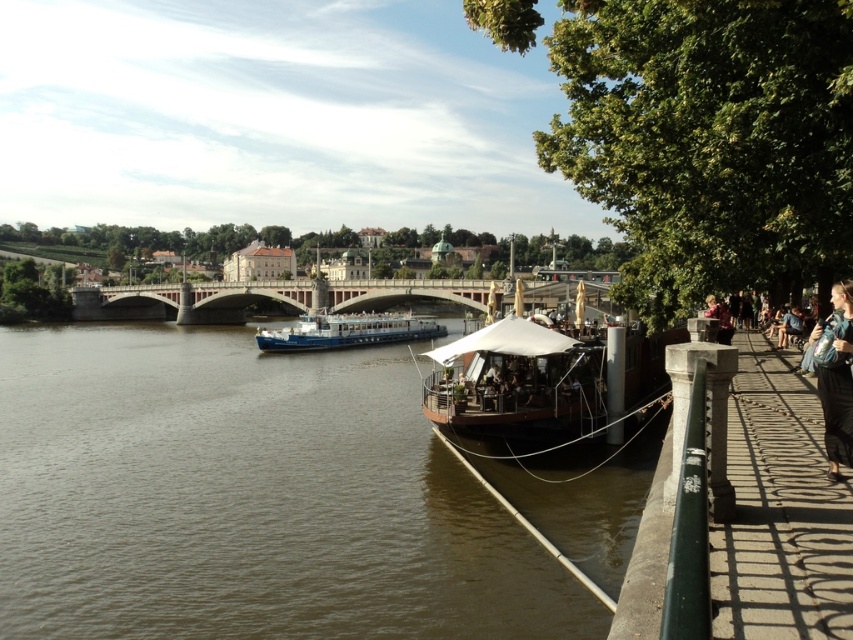
You are a photographer standing on the walkway. You want to capture a photo of the brown water at center without the concrete bridge at center blocking the view. Is there a way to do this?

The brown water at center is positioned under the concrete bridge at center, so to avoid the bridge blocking the view, you can lower your camera angle to shoot from below the bridge level or move to a position where the bridge is not directly above the water.

You are a photographer standing on the walkway. You want to take a photo of the brown water at center and the concrete bridge at center. Which object appears larger in the photo?

The brown water at center appears larger in the photo because it is much taller than the concrete bridge at center.

You are standing on the walkway with a metal railing on the right side of the image. You want to take a photo of the brown water at center. In which direction should you point your camera to capture it?

The brown water at center is located at point coordinates, so you should point your camera towards the center of the image to capture it.